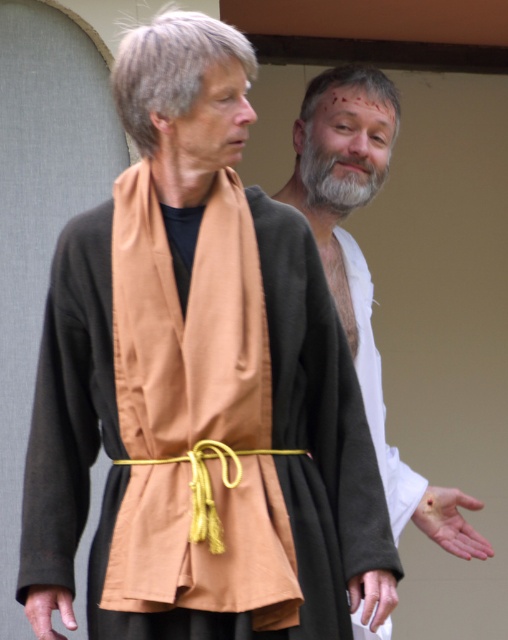
You are standing at the center of the image and need to locate the white matte shirt at upper right. Which direction should you turn to face it?

The white matte shirt at upper right is located at point 0.422 on the x axis and 0.719 on the y axis. Since you are at the center, you should turn to your right to face the white matte shirt at upper right.

You are an assistant helping to organize a costume fitting session. You notice the white matte shirt at upper right and the gray matte beard at center. Which costume accessory is positioned lower in the image?

The white matte shirt at upper right is below gray matte beard at center, so the white matte shirt at upper right is positioned lower in the image.